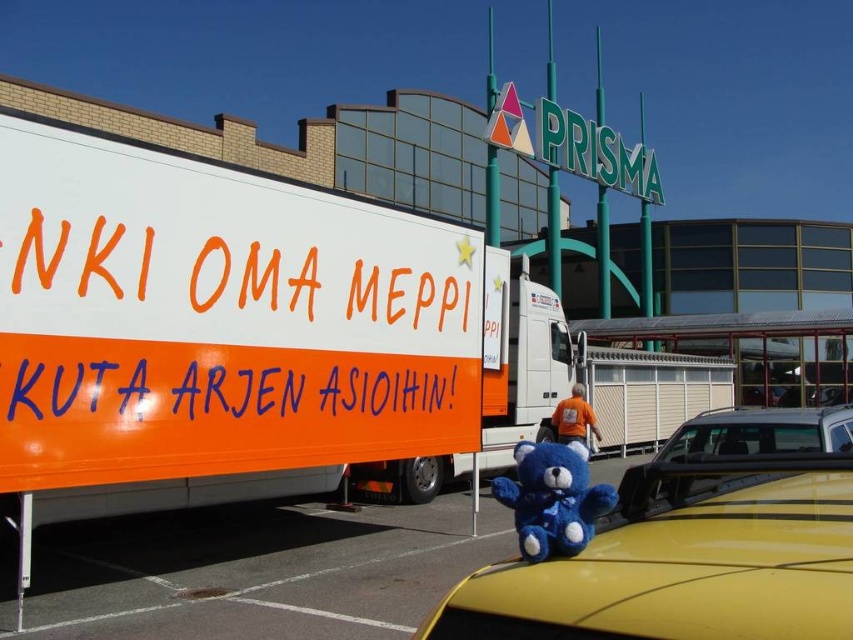
Question: Which object is farther from the camera taking this photo?

Choices:
 (A) blue plush bear at center
 (B) orange matte trailer truck at left
 (C) metallic silver car at lower right

Answer: (A)

Question: Which is farther from the metallic silver car at lower right?

Choices:
 (A) blue plush bear at center
 (B) blue plush toy at center

Answer: (A)

Question: Does orange matte trailer truck at left come in front of blue plush bear at center?

Choices:
 (A) yes
 (B) no

Answer: (A)

Question: Is orange matte trailer truck at left positioned behind metallic silver car at lower right?

Choices:
 (A) no
 (B) yes

Answer: (B)

Question: Observing the image, what is the correct spatial positioning of blue plush toy at center in reference to metallic silver car at lower right?

Choices:
 (A) left
 (B) right

Answer: (A)

Question: Which point is farther to the camera?

Choices:
 (A) orange matte trailer truck at left
 (B) metallic silver car at lower right
 (C) blue plush bear at center
 (D) blue plush toy at center

Answer: (C)